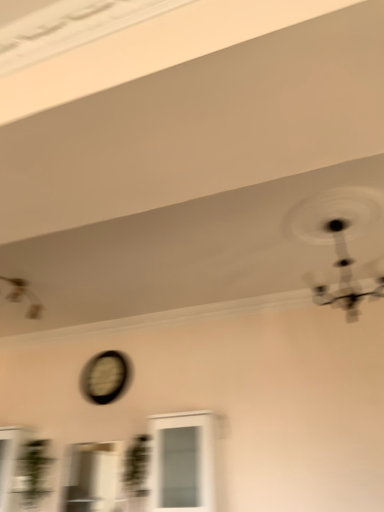
Question: Is point (152, 506) positioned closer to the camera than point (99, 467)?

Choices:
 (A) farther
 (B) closer

Answer: (B)

Question: In terms of width, does white glass cabinet at center, positioned as the 2th window in left-to-right order, look wider or thinner when compared to clear glass window at center, marked as the 1th window in a left-to-right arrangement?

Choices:
 (A) wide
 (B) thin

Answer: (A)

Question: Based on their relative distances, which object is farther from the white glass cabinet at center, the first window in the right-to-left sequence?

Choices:
 (A) metallic silver mechanical fan at upper right, the first mechanical fan from the front
 (B) clear glass window at center, marked as the 1th window in a left-to-right arrangement
 (C) matte black clock at center
 (D) metallic silver mechanical fan at upper left, marked as the first mechanical fan in a left-to-right arrangement

Answer: (D)

Question: Considering the real-world distances, which object is closest to the clear glass window at center, marked as the 1th window in a left-to-right arrangement?

Choices:
 (A) matte black clock at center
 (B) white glass cabinet at center, the first window in the right-to-left sequence
 (C) metallic silver mechanical fan at upper right, the first mechanical fan from the front
 (D) metallic silver mechanical fan at upper left, positioned as the first mechanical fan in back-to-front order

Answer: (A)